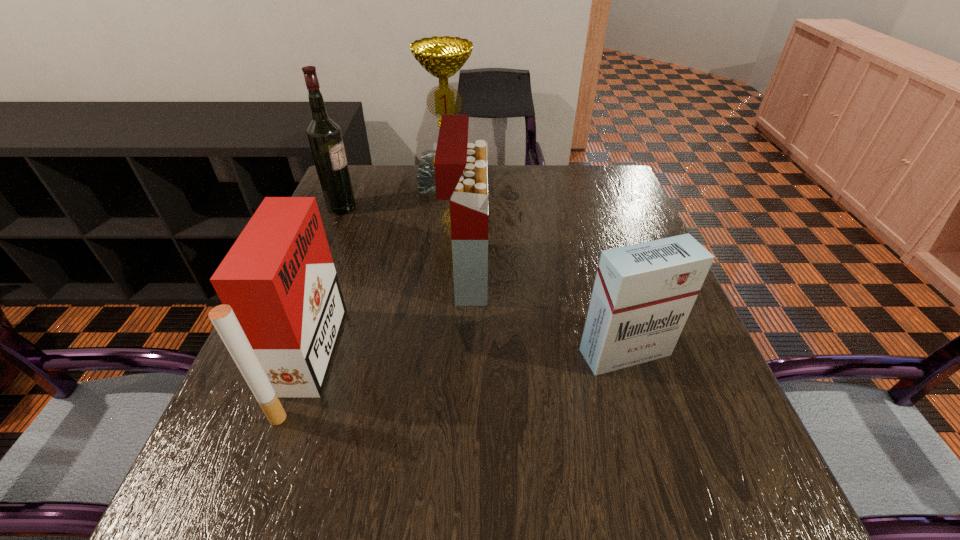
Locate an element on the screen. The width and height of the screenshot is (960, 540). blank space at the far right corner of the desktop is located at coordinates (604, 170).

In the image, there is a desktop. At what (x,y) coordinates should I click in order to perform the action: click on vacant space at the near right corner. Please return your answer as a coordinate pair (x, y). The image size is (960, 540). Looking at the image, I should click on (706, 526).

Find the location of `vacant point located between the tallest cigarette case and the rightmost cigarette case`. vacant point located between the tallest cigarette case and the rightmost cigarette case is located at coordinates pyautogui.click(x=546, y=313).

Where is `vacant space that's between the second cigarette case from left to right and the second farthest object`? This screenshot has height=540, width=960. vacant space that's between the second cigarette case from left to right and the second farthest object is located at coordinates (404, 241).

The image size is (960, 540). What are the coordinates of `vacant area that lies between the leftmost cigarette case and the award` in the screenshot? It's located at (379, 270).

This screenshot has width=960, height=540. In order to click on empty space between the tallest cigarette case and the second farthest object in this screenshot , I will do `click(404, 241)`.

Where is `unoccupied position between the farthest cigarette case and the leftmost cigarette case`? unoccupied position between the farthest cigarette case and the leftmost cigarette case is located at coordinates (388, 318).

The height and width of the screenshot is (540, 960). In order to click on free space between the second farthest object and the tallest cigarette case in this screenshot , I will do `click(404, 241)`.

At what (x,y) coordinates should I click in order to perform the action: click on free space between the rightmost object and the tallest cigarette case. Please return your answer as a coordinate pair (x, y). The height and width of the screenshot is (540, 960). Looking at the image, I should click on (546, 313).

Locate an element on the screen. free space that is in between the leftmost cigarette case and the award is located at coordinates (379, 270).